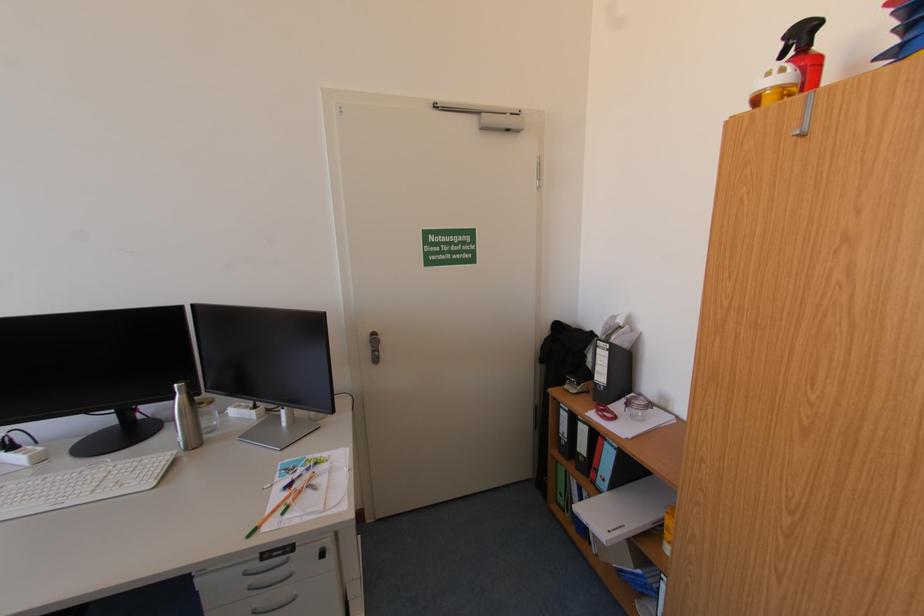
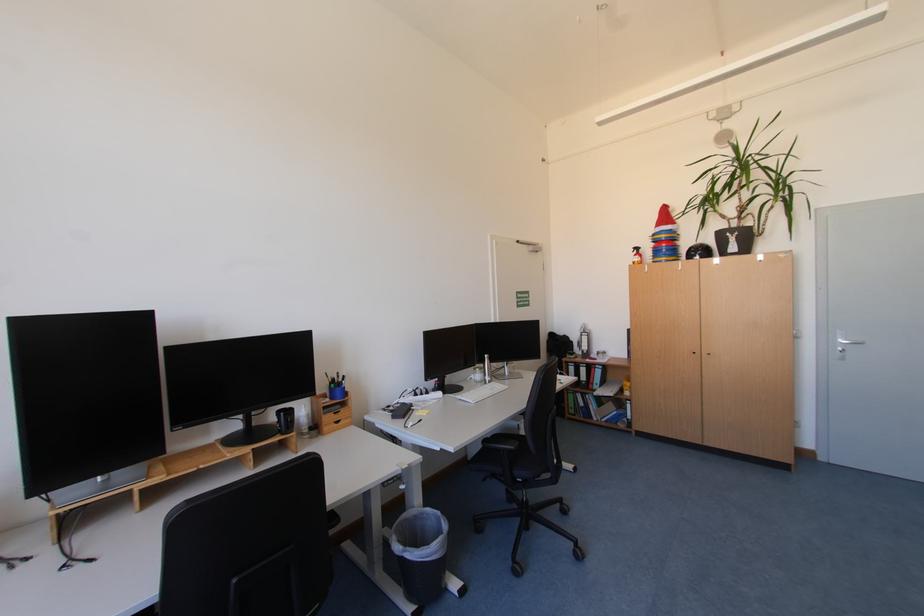
Locate, in the second image, the point that corresponds to (x=590, y=431) in the first image.

(590, 371)